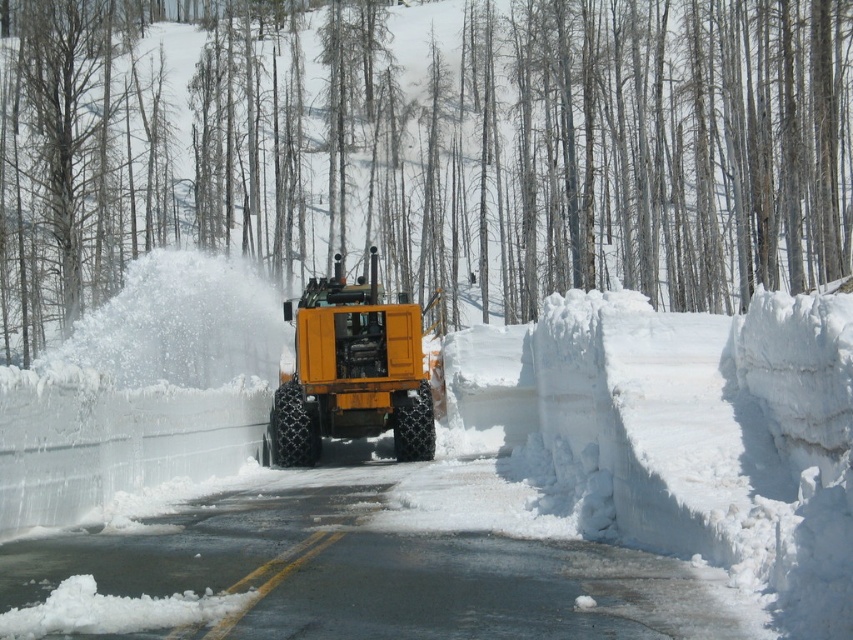
How much distance is there between white fluffy snow at center and yellow rubber tire at center?

white fluffy snow at center and yellow rubber tire at center are 4.61 meters apart.

Can you confirm if white fluffy snow at center is thinner than yellow rubber tire at center?

No.

Find the location of `white fluffy snow at center`. white fluffy snow at center is located at coordinates (453, 458).

At what (x,y) coordinates should I click in order to perform the action: click on white fluffy snow at center. Please return your answer as a coordinate pair (x, y). Looking at the image, I should click on (453, 458).

Who is more distant from viewer, (648, 346) or (564, 186)?

Positioned behind is point (564, 186).

The height and width of the screenshot is (640, 853). Find the location of `white fluffy snow at center`. white fluffy snow at center is located at coordinates (453, 458).

Describe the element at coordinates (453, 458) in the screenshot. I see `white fluffy snow at center` at that location.

This screenshot has width=853, height=640. In order to click on white fluffy snow at center in this screenshot , I will do `click(453, 458)`.

Based on the photo, is smooth snow at center to the right of yellow rubber tire at center from the viewer's perspective?

In fact, smooth snow at center is to the left of yellow rubber tire at center.

Is point (809, 164) closer to camera compared to point (425, 378)?

That is False.

Where is `smooth snow at center`? This screenshot has width=853, height=640. smooth snow at center is located at coordinates (555, 147).